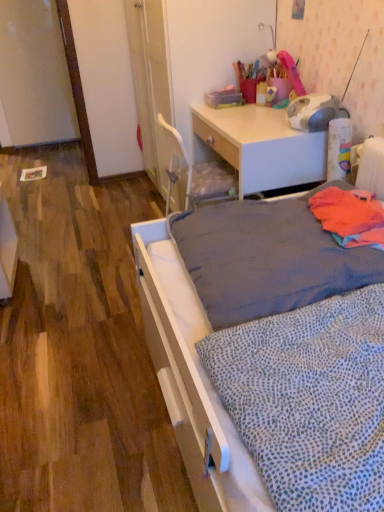
Question: From a real-world perspective, relative to white dotted fabric at lower right, the 2th blanket viewed from the back, is orange fabric at right, which is counted as the first blanket, starting from the top, vertically above or below?

Choices:
 (A) above
 (B) below

Answer: (A)

Question: Is orange fabric at right, which is counted as the first blanket, starting from the top, situated inside white dotted fabric at lower right, the 2th blanket viewed from the back, or outside?

Choices:
 (A) inside
 (B) outside

Answer: (B)

Question: Considering the real-world distances, which object is closest to the gray fabric mattress at center?

Choices:
 (A) white dotted fabric at lower right, the 1th blanket from the bottom
 (B) orange fabric at right, arranged as the 2th blanket when ordered from the bottom
 (C) white glossy desk at upper center

Answer: (B)

Question: Estimate the real-world distances between objects in this image. Which object is closer to the white glossy desk at upper center?

Choices:
 (A) orange fabric at right, arranged as the 2th blanket when ordered from the bottom
 (B) white dotted fabric at lower right, the 1th blanket from the bottom
 (C) gray fabric mattress at center

Answer: (A)